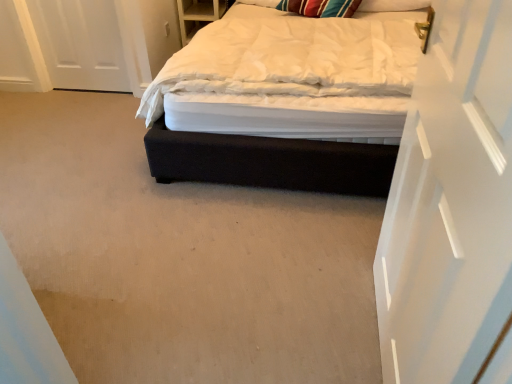
Measure the distance between point (422, 336) and camera.

Point (422, 336) and camera are 1.00 meters apart from each other.

What do you see at coordinates (450, 203) in the screenshot? The width and height of the screenshot is (512, 384). I see `white glossy door at upper right` at bounding box center [450, 203].

I want to click on dark fabric bed at center, so click(x=288, y=100).

Locate an element on the screen. white glossy door at upper right is located at coordinates (450, 203).

Is striped fabric pillow at upper right facing away from dark fabric bed at center?

Yes, striped fabric pillow at upper right is facing away from dark fabric bed at center.

Is point (395, 6) positioned after point (311, 81)?

Yes, it is.

Can you confirm if striped fabric pillow at upper right is smaller than dark fabric bed at center?

Yes.

In the scene shown: How many degrees apart are the facing directions of striped fabric pillow at upper right and dark fabric bed at center?

The angular difference between striped fabric pillow at upper right and dark fabric bed at center is 4.01 degrees.

Is white glossy door at upper right oriented towards dark fabric bed at center?

No, white glossy door at upper right is not aimed at dark fabric bed at center.

From their relative heights in the image, would you say white glossy door at upper right is taller or shorter than dark fabric bed at center?

white glossy door at upper right is taller than dark fabric bed at center.

Is point (423, 290) more distant than point (206, 45)?

No, (423, 290) is closer to viewer.

How many degrees apart are the facing directions of white glossy door at upper right and dark fabric bed at center?

The facing directions of white glossy door at upper right and dark fabric bed at center are 89.8 degrees apart.

Are striped fabric pillow at upper right and white glossy door at upper right located far from each other?

striped fabric pillow at upper right is positioned a significant distance from white glossy door at upper right.

Would you say striped fabric pillow at upper right is outside white glossy door at upper right?

Absolutely, striped fabric pillow at upper right is external to white glossy door at upper right.

From the image's perspective, which object appears higher, striped fabric pillow at upper right or white glossy door at upper right?

striped fabric pillow at upper right, from the image's perspective.

From a real-world perspective, is dark fabric bed at center positioned over white glossy door at upper right based on gravity?

No, from a real-world perspective, dark fabric bed at center is not above white glossy door at upper right.

Find the location of a particular element. This screenshot has height=384, width=512. bed above the white glossy door at upper right (from the image's perspective) is located at coordinates (288, 100).

Is white glossy door at upper right at the back of dark fabric bed at center?

That's not correct — dark fabric bed at center is not looking away from white glossy door at upper right.

Considering the positions of objects dark fabric bed at center and white glossy door at upper right in the image provided, who is behind, dark fabric bed at center or white glossy door at upper right?

dark fabric bed at center is further from the camera.

Could you tell me if white glossy door at upper right is turned towards striped fabric pillow at upper right?

No, white glossy door at upper right is not turned towards striped fabric pillow at upper right.

Considering the points (398, 179) and (384, 3), which point is in front, point (398, 179) or point (384, 3)?

Positioned in front is point (398, 179).

In the scene shown: Can you tell me how much white glossy door at upper right and striped fabric pillow at upper right differ in facing direction?

The facing directions of white glossy door at upper right and striped fabric pillow at upper right are 85.8 degrees apart.

Is white glossy door at upper right spatially inside striped fabric pillow at upper right, or outside of it?

white glossy door at upper right cannot be found inside striped fabric pillow at upper right.

Considering the positions of objects dark fabric bed at center and striped fabric pillow at upper right in the image provided, who is more to the left, dark fabric bed at center or striped fabric pillow at upper right?

dark fabric bed at center is more to the left.

Is dark fabric bed at center taller or shorter than striped fabric pillow at upper right?

dark fabric bed at center is taller than striped fabric pillow at upper right.

What's the angular difference between dark fabric bed at center and striped fabric pillow at upper right's facing directions?

The facing directions of dark fabric bed at center and striped fabric pillow at upper right are 4.01 degrees apart.

From a real-world perspective, which is physically below, dark fabric bed at center or striped fabric pillow at upper right?

dark fabric bed at center is physically lower.

Locate an element on the screen. pillow above the dark fabric bed at center (from a real-world perspective) is located at coordinates (392, 5).

Where is `bed that is above the white glossy door at upper right (from the image's perspective)`? bed that is above the white glossy door at upper right (from the image's perspective) is located at coordinates (288, 100).

Estimate the real-world distances between objects in this image. Which object is closer to striped fabric pillow at upper right, white glossy door at upper right or dark fabric bed at center?

dark fabric bed at center lies closer to striped fabric pillow at upper right than the other object.

Considering their positions, is dark fabric bed at center positioned further to white glossy door at upper right than striped fabric pillow at upper right?

striped fabric pillow at upper right is further to white glossy door at upper right.

Looking at the image, which one is located closer to dark fabric bed at center, striped fabric pillow at upper right or white glossy door at upper right?

white glossy door at upper right lies closer to dark fabric bed at center than the other object.

Based on their spatial positions, is dark fabric bed at center or white glossy door at upper right closer to striped fabric pillow at upper right?

dark fabric bed at center is closer to striped fabric pillow at upper right.

When comparing their distances from dark fabric bed at center, does white glossy door at upper right or striped fabric pillow at upper right seem closer?

white glossy door at upper right is closer to dark fabric bed at center.

Looking at the image, which one is located closer to white glossy door at upper right, striped fabric pillow at upper right or dark fabric bed at center?

dark fabric bed at center.

At what (x,y) coordinates should I click in order to perform the action: click on bed positioned between white glossy door at upper right and striped fabric pillow at upper right from near to far. Please return your answer as a coordinate pair (x, y). Image resolution: width=512 pixels, height=384 pixels. Looking at the image, I should click on (288, 100).